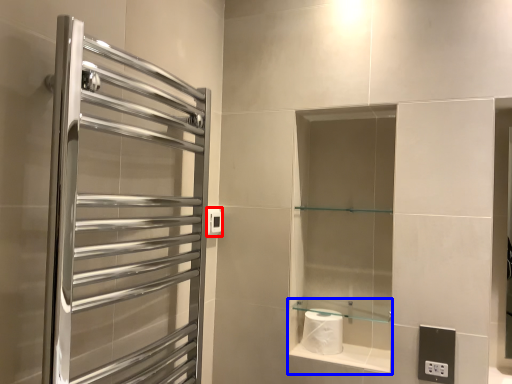
Question: Which of the following is the farthest to the observer, electric outlet (highlighted by a red box) or cabinet (highlighted by a blue box)?

Choices:
 (A) electric outlet
 (B) cabinet

Answer: (A)